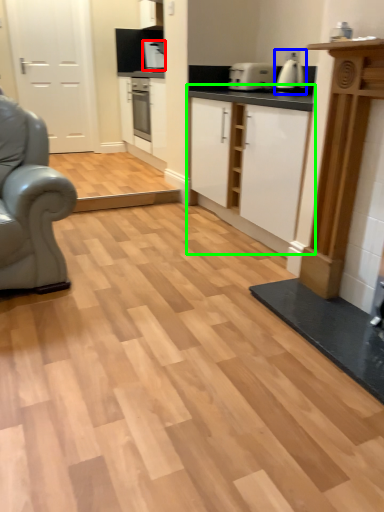
Question: Considering the real-world distances, which object is farthest from coffee machine (highlighted by a red box)? coffee machine (highlighted by a blue box) or cabinetry (highlighted by a green box)?

Choices:
 (A) coffee machine
 (B) cabinetry

Answer: (A)